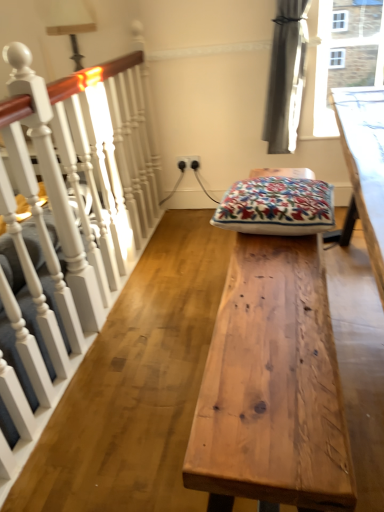
Question: From a real-world perspective, is white painted wood at left below embroidered cotton cushion at center?

Choices:
 (A) no
 (B) yes

Answer: (B)

Question: Would you say white painted wood at left is outside embroidered cotton cushion at center?

Choices:
 (A) yes
 (B) no

Answer: (A)

Question: Considering the relative positions of white painted wood at left and embroidered cotton cushion at center in the image provided, is white painted wood at left in front of embroidered cotton cushion at center?

Choices:
 (A) yes
 (B) no

Answer: (A)

Question: Considering the relative sizes of white painted wood at left and embroidered cotton cushion at center in the image provided, is white painted wood at left smaller than embroidered cotton cushion at center?

Choices:
 (A) no
 (B) yes

Answer: (A)

Question: Considering the relative sizes of white painted wood at left and embroidered cotton cushion at center in the image provided, is white painted wood at left shorter than embroidered cotton cushion at center?

Choices:
 (A) yes
 (B) no

Answer: (B)

Question: Based on their sizes in the image, would you say white painted wood at left is bigger or smaller than natural wood table at center?

Choices:
 (A) small
 (B) big

Answer: (B)

Question: Is white painted wood at left in front of or behind natural wood table at center in the image?

Choices:
 (A) front
 (B) behind

Answer: (A)

Question: Is white painted wood at left to the left or to the right of natural wood table at center in the image?

Choices:
 (A) right
 (B) left

Answer: (B)

Question: From the image's perspective, is white painted wood at left positioned above or below natural wood table at center?

Choices:
 (A) below
 (B) above

Answer: (B)

Question: From the image's perspective, is white painted wood at left located above or below embroidered cotton cushion at center?

Choices:
 (A) above
 (B) below

Answer: (A)

Question: Considering their positions, is white painted wood at left located in front of or behind embroidered cotton cushion at center?

Choices:
 (A) behind
 (B) front

Answer: (B)

Question: Considering the positions of white painted wood at left and embroidered cotton cushion at center in the image, is white painted wood at left bigger or smaller than embroidered cotton cushion at center?

Choices:
 (A) small
 (B) big

Answer: (B)

Question: Which is correct: white painted wood at left is inside embroidered cotton cushion at center, or outside of it?

Choices:
 (A) inside
 (B) outside

Answer: (B)

Question: From the image's perspective, is natural wood table at center above or below white painted wood at left?

Choices:
 (A) above
 (B) below

Answer: (B)

Question: Looking at the image, does natural wood table at center seem bigger or smaller compared to white painted wood at left?

Choices:
 (A) big
 (B) small

Answer: (B)